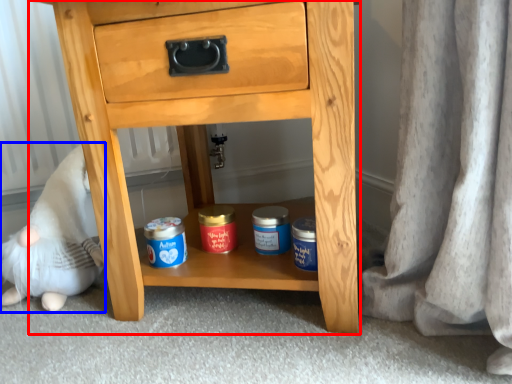
Question: Which point is further to the camera, chest of drawers (highlighted by a red box) or toy (highlighted by a blue box)?

Choices:
 (A) chest of drawers
 (B) toy

Answer: (B)